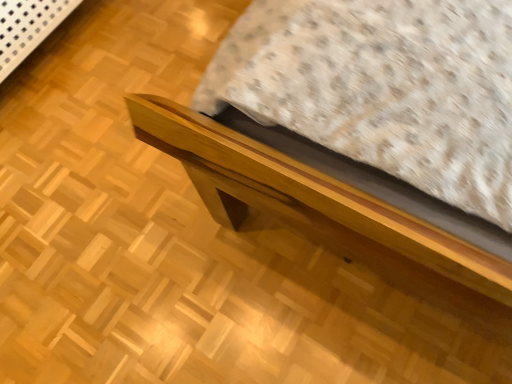
Locate an element on the screen. matte wood bed frame at center is located at coordinates (335, 92).

The width and height of the screenshot is (512, 384). Describe the element at coordinates (335, 92) in the screenshot. I see `matte wood bed frame at center` at that location.

You are a GUI agent. You are given a task and a screenshot of the screen. Output one action in this format:
    pyautogui.click(x=<x>, y=<y>)
    Task: Click on the matte wood bed frame at center
    Image resolution: width=512 pixels, height=384 pixels.
    Given the screenshot: What is the action you would take?
    pyautogui.click(x=335, y=92)